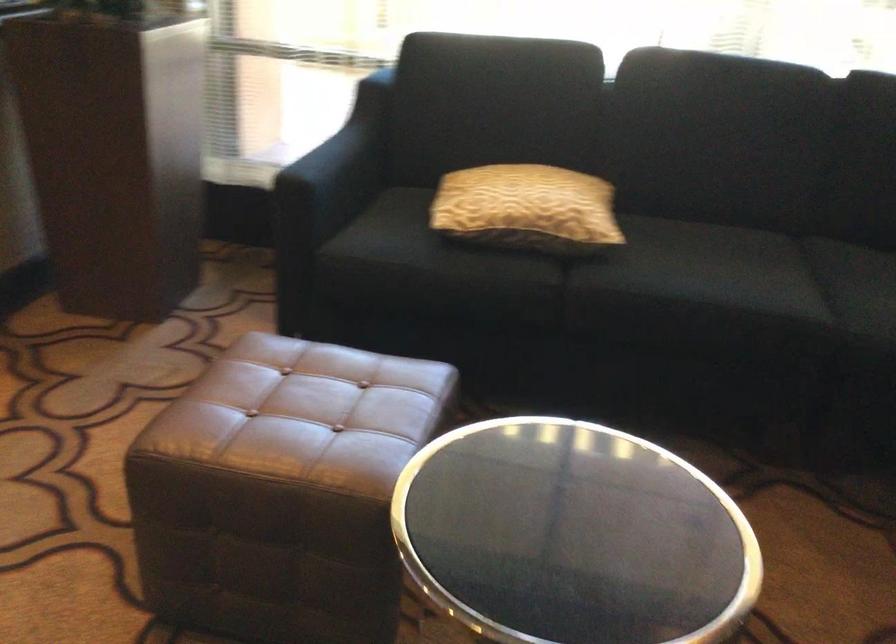
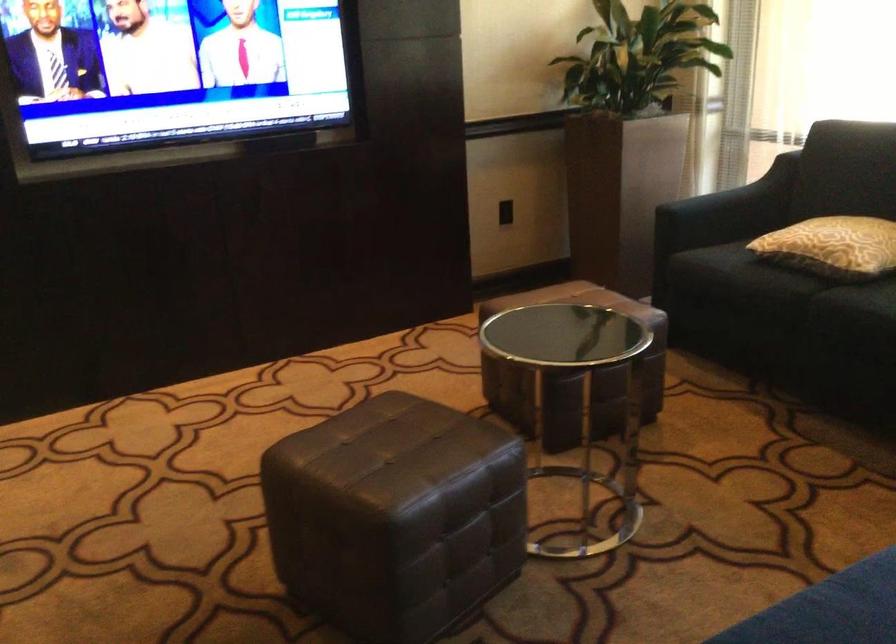
Find the pixel in the second image that matches point 357,156 in the first image.

(742, 196)